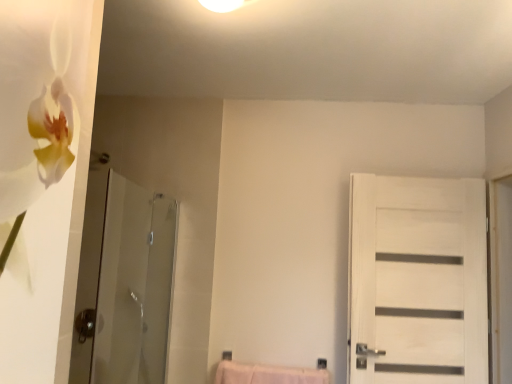
This screenshot has height=384, width=512. Describe the element at coordinates (134, 285) in the screenshot. I see `transparent glass shower door at left` at that location.

Where is `transparent glass shower door at left`? The image size is (512, 384). transparent glass shower door at left is located at coordinates (134, 285).

Where is `white wood door at right`? white wood door at right is located at coordinates (417, 280).

What do you see at coordinates (417, 280) in the screenshot?
I see `white wood door at right` at bounding box center [417, 280].

The image size is (512, 384). In order to click on transparent glass shower door at left in this screenshot , I will do click(134, 285).

Based on their positions, is white wood door at right located to the left or right of transparent glass shower door at left?

white wood door at right is to the right of transparent glass shower door at left.

Considering their positions, is white wood door at right located in front of or behind transparent glass shower door at left?

white wood door at right is positioned farther from the viewer than transparent glass shower door at left.

Which is nearer, (x=408, y=352) or (x=111, y=310)?

Point (x=408, y=352) appears to be closer to the viewer than point (x=111, y=310).

From the image's perspective, is white wood door at right on transparent glass shower door at left?

No, from the image's perspective, white wood door at right is not over transparent glass shower door at left.

Looking at this image, from a real-world perspective, who is located higher, white wood door at right or transparent glass shower door at left?

From a 3D spatial view, white wood door at right is above.

Between white wood door at right and transparent glass shower door at left, which one has smaller width?

With smaller width is white wood door at right.

Considering the sizes of white wood door at right and transparent glass shower door at left in the image, is white wood door at right taller or shorter than transparent glass shower door at left?

white wood door at right is taller than transparent glass shower door at left.

Consider the image. Between white wood door at right and transparent glass shower door at left, which one has smaller size?

Smaller between the two is white wood door at right.

Is white wood door at right completely or partially outside of transparent glass shower door at left?

Yes, white wood door at right is outside of transparent glass shower door at left.

Is white wood door at right far away from transparent glass shower door at left?

Yes, white wood door at right and transparent glass shower door at left are located far from each other.

Is white wood door at right positioned with its back to transparent glass shower door at left?

white wood door at right does not have its back to transparent glass shower door at left.

Based on the photo, how many degrees apart are the facing directions of white wood door at right and transparent glass shower door at left?

94.7 degrees separate the facing orientations of white wood door at right and transparent glass shower door at left.

What are the coordinates of `screen door located on the left of white wood door at right` in the screenshot? It's located at (134, 285).

Is transparent glass shower door at left at the left side of white wood door at right?

Indeed, transparent glass shower door at left is positioned on the left side of white wood door at right.

Between transparent glass shower door at left and white wood door at right, which one is positioned behind?

white wood door at right is behind.

Which is closer, (148, 236) or (384, 250)?

Point (148, 236) appears to be farther away from the viewer than point (384, 250).

From the image's perspective, between transparent glass shower door at left and white wood door at right, which one is located above?

transparent glass shower door at left.

From a real-world perspective, who is located lower, transparent glass shower door at left or white wood door at right?

transparent glass shower door at left.

Considering the sizes of objects transparent glass shower door at left and white wood door at right in the image provided, who is thinner, transparent glass shower door at left or white wood door at right?

With smaller width is white wood door at right.

Which of these two, transparent glass shower door at left or white wood door at right, stands taller?

white wood door at right.

Considering the relative sizes of transparent glass shower door at left and white wood door at right in the image provided, is transparent glass shower door at left bigger than white wood door at right?

Yes.

Is transparent glass shower door at left surrounding white wood door at right?

No, white wood door at right is not surrounded by transparent glass shower door at left.

Are transparent glass shower door at left and white wood door at right beside each other?

No, transparent glass shower door at left is not making contact with white wood door at right.

Is white wood door at right at the back of transparent glass shower door at left?

transparent glass shower door at left is not turned away from white wood door at right.

How distant is transparent glass shower door at left from white wood door at right?

A distance of 4.33 feet exists between transparent glass shower door at left and white wood door at right.

Identify the location of screen door lying in front of the white wood door at right. This screenshot has height=384, width=512. (134, 285).

You are a GUI agent. You are given a task and a screenshot of the screen. Output one action in this format:
    pyautogui.click(x=<x>, y=<y>)
    Task: Click on the door located behind the transparent glass shower door at left
    This screenshot has height=384, width=512.
    Given the screenshot: What is the action you would take?
    pyautogui.click(x=417, y=280)

This screenshot has height=384, width=512. I want to click on door below the transparent glass shower door at left (from the image's perspective), so click(417, 280).